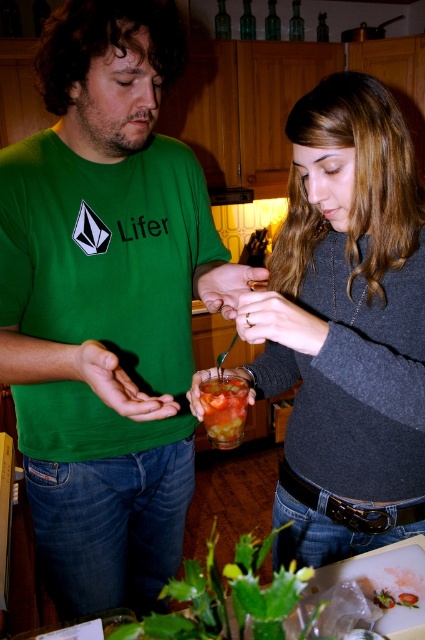
You are a chef preparing a meal and need to choose between the tomato soup at center and the strawberry jam jar at center. Which one has a bigger capacity for holding liquid?

The tomato soup at center has a larger size compared to the strawberry jam jar at center, so it can hold more liquid.